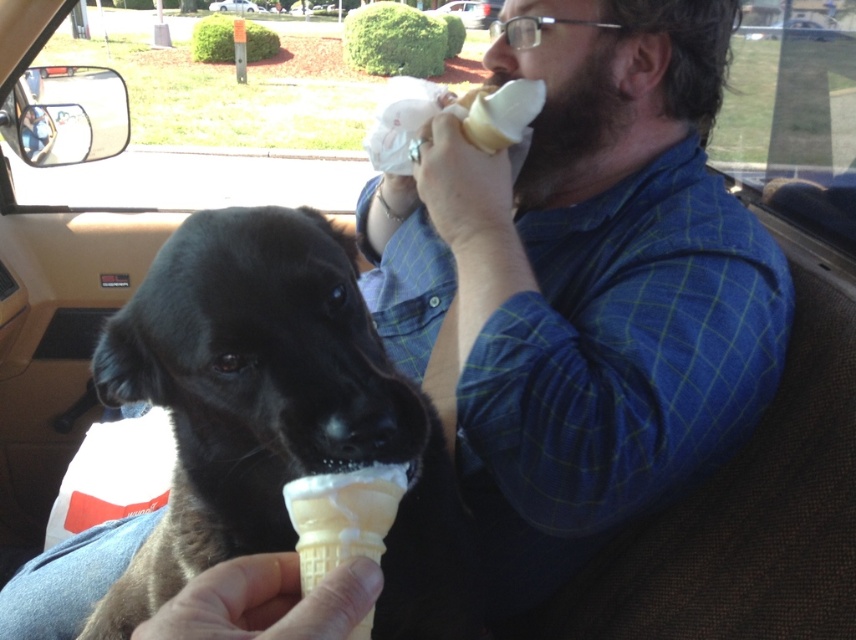
Between black fur dog at center and metallic silver car at upper center, which one has more height?

metallic silver car at upper center is taller.

Is black fur dog at center to the right of metallic silver car at upper center from the viewer's perspective?

No, black fur dog at center is not to the right of metallic silver car at upper center.

Who is more distant from viewer, (342, 390) or (483, 17)?

The point (483, 17) is behind.

Identify the location of black fur dog at center. This screenshot has height=640, width=856. (276, 413).

Which is below, metallic silver car at upper center or white plastic bag at center?

metallic silver car at upper center is lower down.

Locate an element on the screen. metallic silver car at upper center is located at coordinates (471, 12).

Where is `metallic silver car at upper center`? metallic silver car at upper center is located at coordinates (471, 12).

Is vanilla waffle cone at center to the left of white plastic bag at center from the viewer's perspective?

Incorrect, vanilla waffle cone at center is not on the left side of white plastic bag at center.

Is vanilla waffle cone at center bigger than white plastic bag at center?

No, vanilla waffle cone at center is not bigger than white plastic bag at center.

You are a GUI agent. You are given a task and a screenshot of the screen. Output one action in this format:
    pyautogui.click(x=<x>, y=<y>)
    Task: Click on the vanilla waffle cone at center
    
    Given the screenshot: What is the action you would take?
    pyautogui.click(x=342, y=516)

The width and height of the screenshot is (856, 640). What are the coordinates of `vanilla waffle cone at center` in the screenshot? It's located at (342, 516).